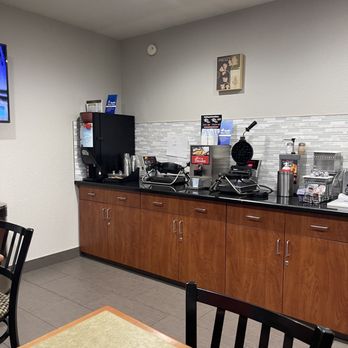
Identify the location of cabinet doors. (92, 232), (124, 236), (167, 254), (201, 249), (247, 269), (309, 267).